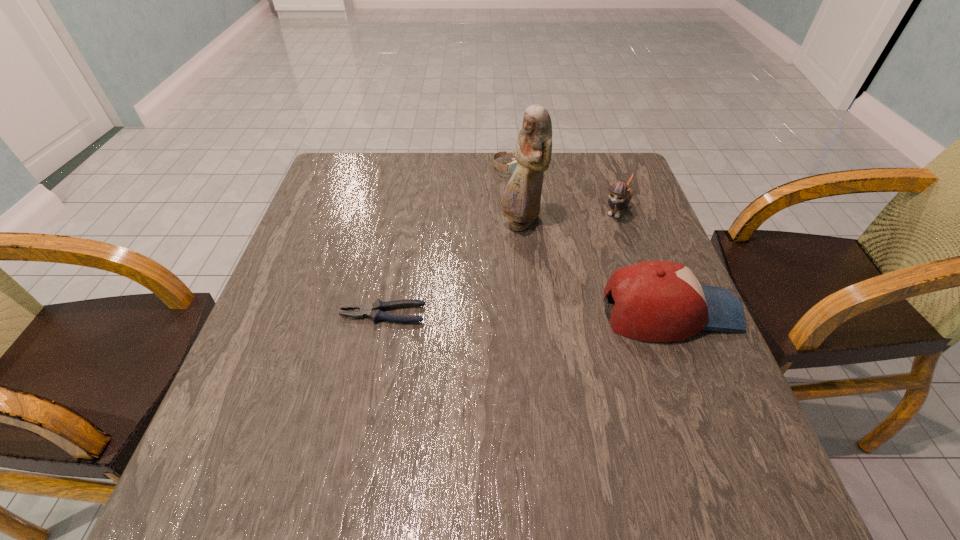
Image resolution: width=960 pixels, height=540 pixels. In order to click on watch present at the far edge in this screenshot , I will do `click(512, 166)`.

Locate an element on the screen. The height and width of the screenshot is (540, 960). object that is at the left edge is located at coordinates (375, 310).

The width and height of the screenshot is (960, 540). In order to click on baseball cap that is at the right edge in this screenshot , I will do `click(655, 301)`.

Find the location of a particular element. The width and height of the screenshot is (960, 540). kitten at the right edge is located at coordinates (620, 194).

I want to click on object that is at the far right corner, so click(620, 194).

The height and width of the screenshot is (540, 960). Find the location of `vacant space at the far edge of the desktop`. vacant space at the far edge of the desktop is located at coordinates (386, 176).

In order to click on vacant space at the near edge of the desktop in this screenshot , I will do `click(620, 423)`.

In order to click on vacant region at the left edge of the desktop in this screenshot , I will do `click(317, 324)`.

Identify the location of vacant space at the right edge of the desktop. The image size is (960, 540). (715, 361).

The width and height of the screenshot is (960, 540). In order to click on vacant space at the far right corner of the desktop in this screenshot , I will do `click(590, 191)`.